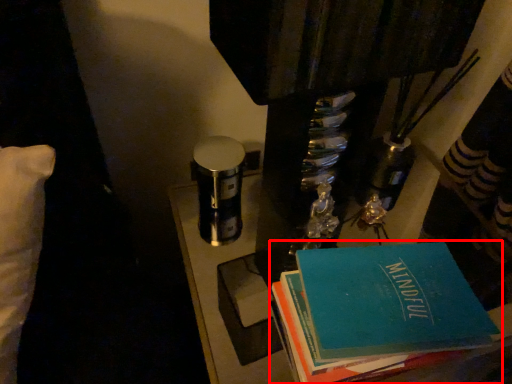
Question: Where is book (annotated by the red box) located in relation to table in the image?

Choices:
 (A) left
 (B) right

Answer: (B)